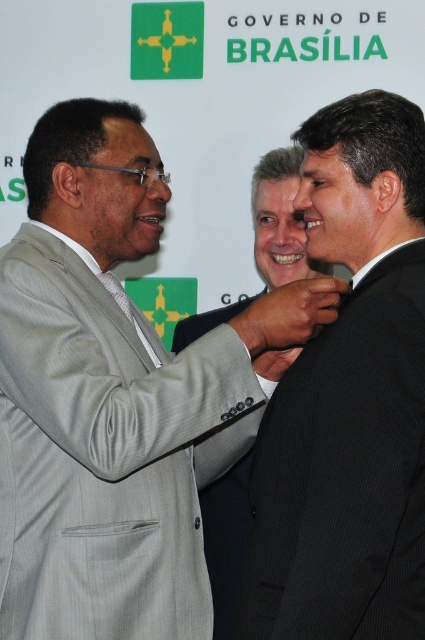
Can you confirm if black pinstripe suit at center is positioned to the right of matte black hand at center?

Yes, black pinstripe suit at center is to the right of matte black hand at center.

Does black pinstripe suit at center have a smaller size compared to matte black hand at center?

Actually, black pinstripe suit at center might be larger than matte black hand at center.

Measure the distance between black pinstripe suit at center and camera.

black pinstripe suit at center is 4.04 feet from camera.

Where is `black pinstripe suit at center`? Image resolution: width=425 pixels, height=640 pixels. black pinstripe suit at center is located at coordinates (350, 397).

In the scene shown: Does light gray pinstripe suit at center come in front of black textured suit at center?

Yes, light gray pinstripe suit at center is in front of black textured suit at center.

Find the location of `light gray pinstripe suit at center`. light gray pinstripe suit at center is located at coordinates (105, 454).

Image resolution: width=425 pixels, height=640 pixels. What do you see at coordinates (105, 454) in the screenshot?
I see `light gray pinstripe suit at center` at bounding box center [105, 454].

Who is positioned more to the left, light gray pinstripe suit at center or dark brown leather hand at center?

From the viewer's perspective, light gray pinstripe suit at center appears more on the left side.

You are a GUI agent. You are given a task and a screenshot of the screen. Output one action in this format:
    pyautogui.click(x=<x>, y=<y>)
    Task: Click on the light gray pinstripe suit at center
    
    Given the screenshot: What is the action you would take?
    pyautogui.click(x=105, y=454)